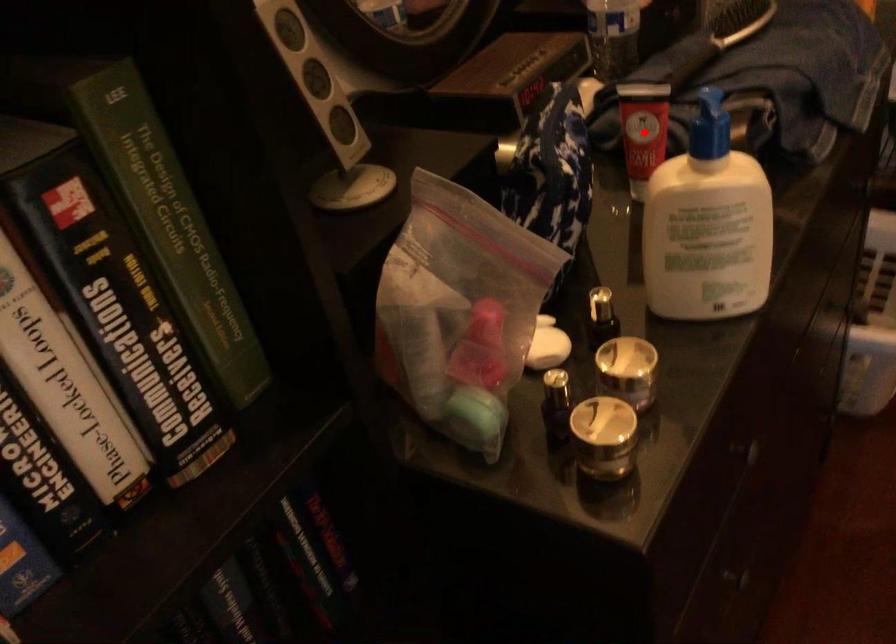
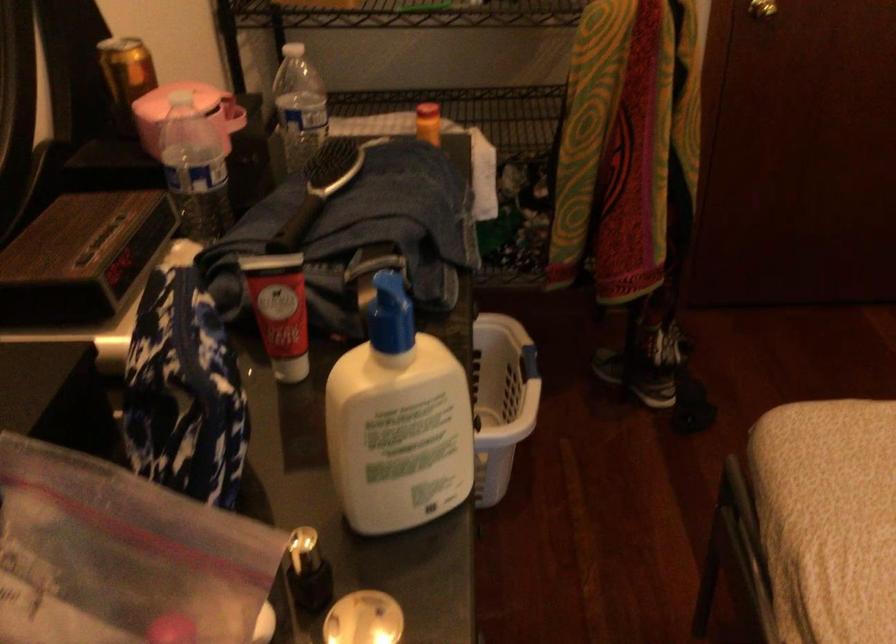
Question: I am providing you with two images of the same scene from different viewpoints. A red point is marked on the first image. Is the red point's position out of view in image 2?

Choices:
 (A) Yes
 (B) No

Answer: (B)